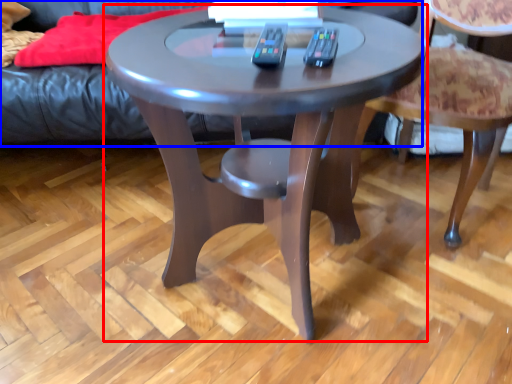
Question: Among these objects, which one is farthest to the camera, coffee table (highlighted by a red box) or couch (highlighted by a blue box)?

Choices:
 (A) coffee table
 (B) couch

Answer: (B)